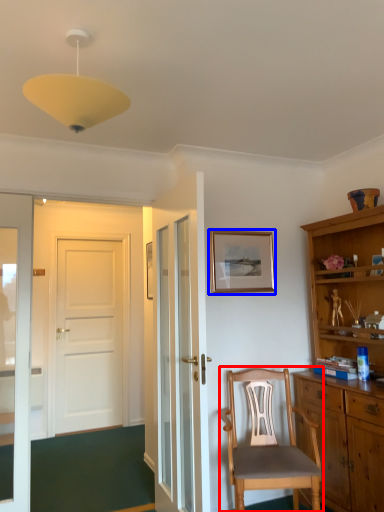
Question: Among these objects, which one is farthest to the camera, chair (highlighted by a red box) or picture frame (highlighted by a blue box)?

Choices:
 (A) chair
 (B) picture frame

Answer: (B)